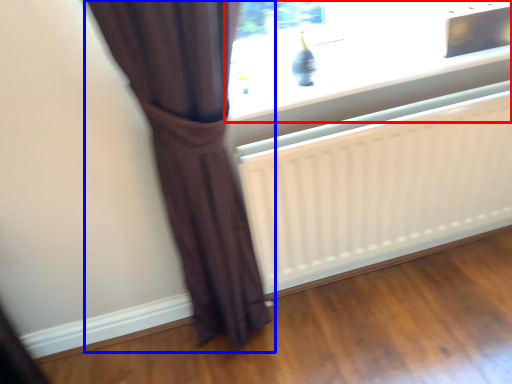
Question: Which of the following is the closest to the observer, window (highlighted by a red box) or curtain (highlighted by a blue box)?

Choices:
 (A) window
 (B) curtain

Answer: (B)